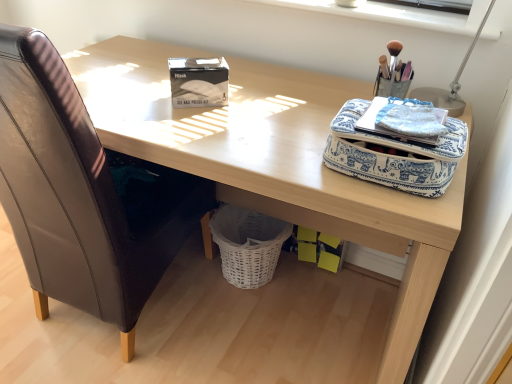
Image resolution: width=512 pixels, height=384 pixels. Identify the location of free space in front of white wicker basket at lower center. (247, 321).